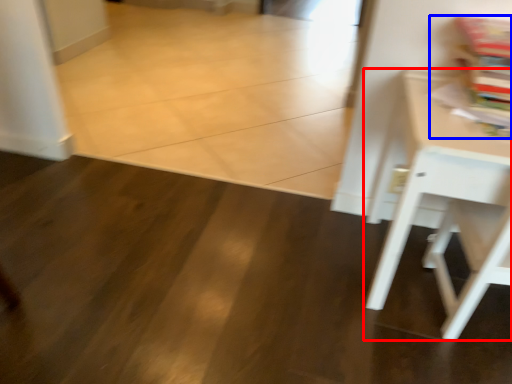
Question: Which of the following is the farthest to the observer, table (highlighted by a red box) or magazine (highlighted by a blue box)?

Choices:
 (A) table
 (B) magazine

Answer: (B)